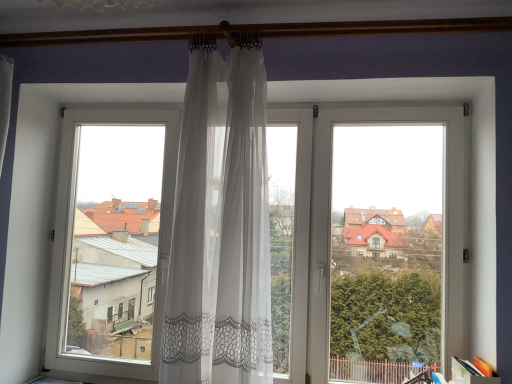
Question: In the image, is transparent lace curtain at center on the left side or the right side of sheer white curtain at center?

Choices:
 (A) right
 (B) left

Answer: (A)

Question: Based on their sizes in the image, would you say transparent lace curtain at center is bigger or smaller than sheer white curtain at center?

Choices:
 (A) small
 (B) big

Answer: (B)

Question: Is transparent lace curtain at center inside the boundaries of sheer white curtain at center, or outside?

Choices:
 (A) outside
 (B) inside

Answer: (A)

Question: Based on their sizes in the image, would you say sheer white curtain at center is bigger or smaller than transparent lace curtain at center?

Choices:
 (A) small
 (B) big

Answer: (A)

Question: From the image's perspective, is sheer white curtain at center positioned above or below transparent lace curtain at center?

Choices:
 (A) above
 (B) below

Answer: (A)

Question: Considering the positions of sheer white curtain at center and transparent lace curtain at center in the image, is sheer white curtain at center taller or shorter than transparent lace curtain at center?

Choices:
 (A) short
 (B) tall

Answer: (A)

Question: From a real-world perspective, relative to transparent lace curtain at center, is sheer white curtain at center vertically above or below?

Choices:
 (A) above
 (B) below

Answer: (A)